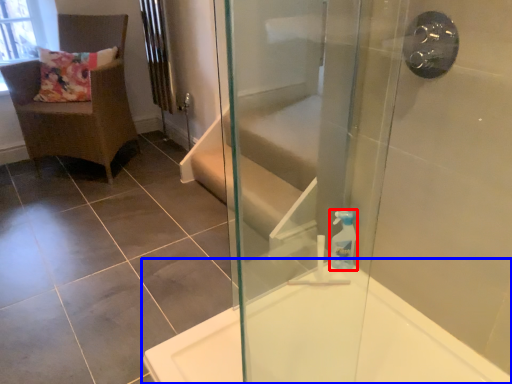
Question: Among these objects, which one is nearest to the camera, soap dispenser (highlighted by a red box) or bathtub (highlighted by a blue box)?

Choices:
 (A) soap dispenser
 (B) bathtub

Answer: (B)